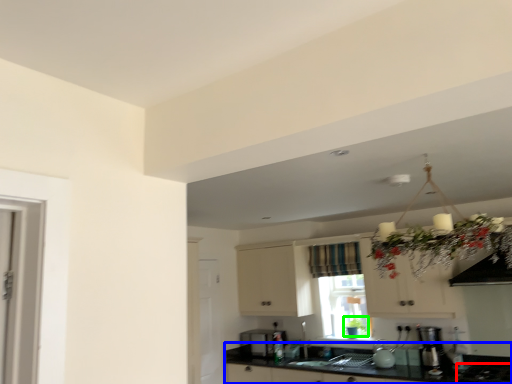
Question: Which is nearer to the gas stove (highlighted by a red box)? countertop (highlighted by a blue box) or plant (highlighted by a green box).

Choices:
 (A) countertop
 (B) plant

Answer: (A)